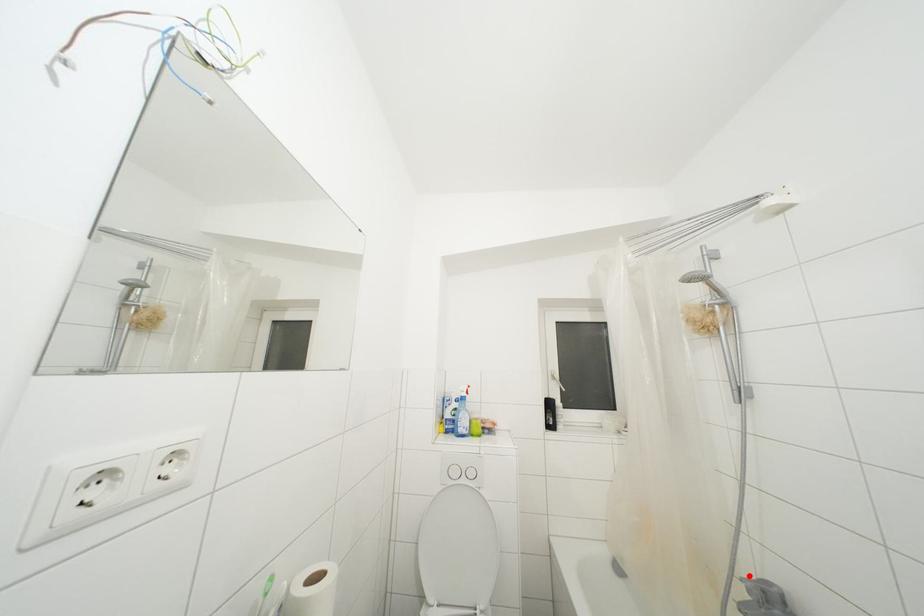
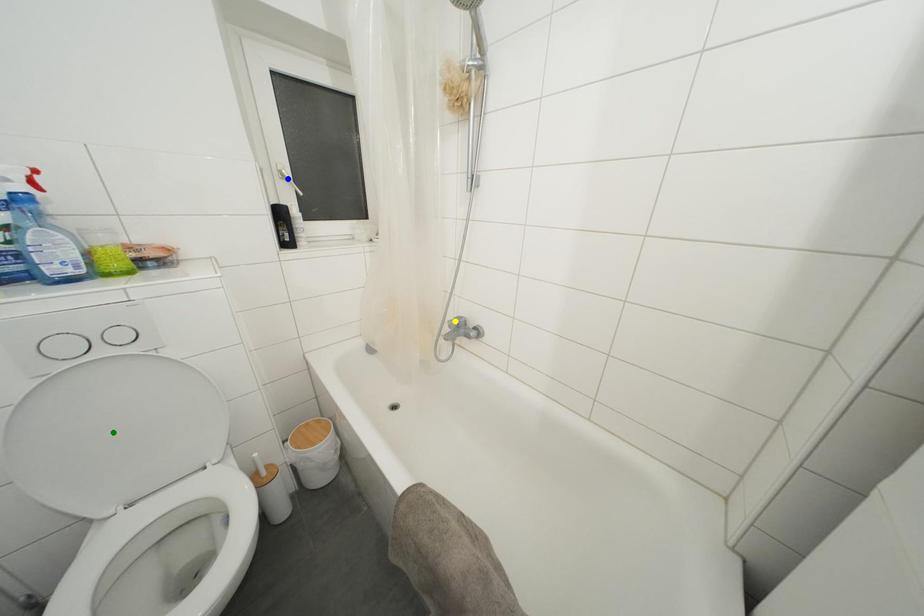
Question: I am providing you with two images of the same scene from different viewpoints. A red point is marked on the first image. You are given multiple points on the second image. In image 2, which mark is for the same physical point as the one in image 1?

Choices:
 (A) yellow point
 (B) green point
 (C) blue point

Answer: (A)